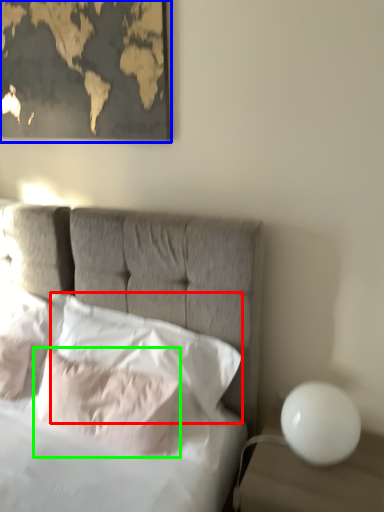
Question: Estimate the real-world distances between objects in this image. Which object is closer to pillow (highlighted by a red box), picture frame (highlighted by a blue box) or pillow (highlighted by a green box)?

Choices:
 (A) picture frame
 (B) pillow

Answer: (B)